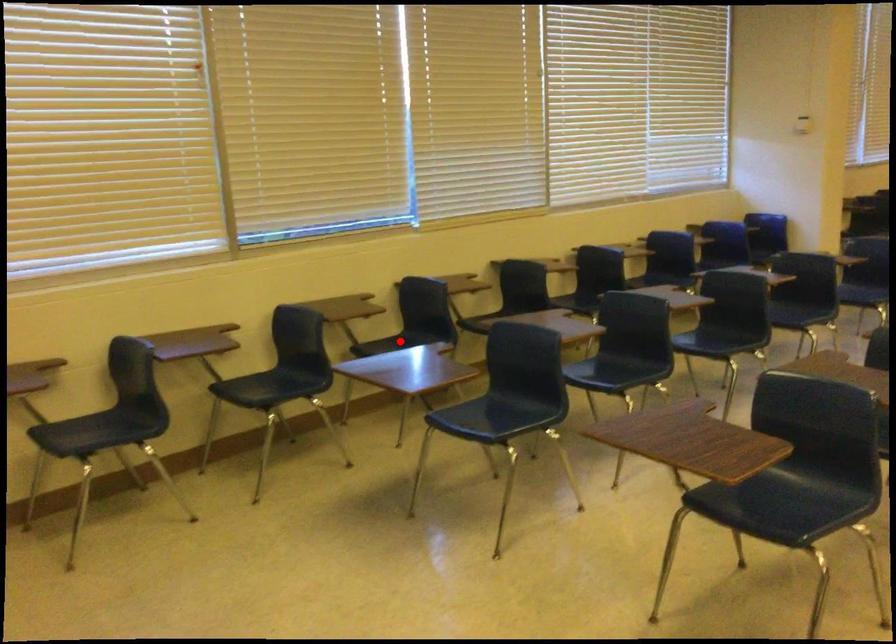
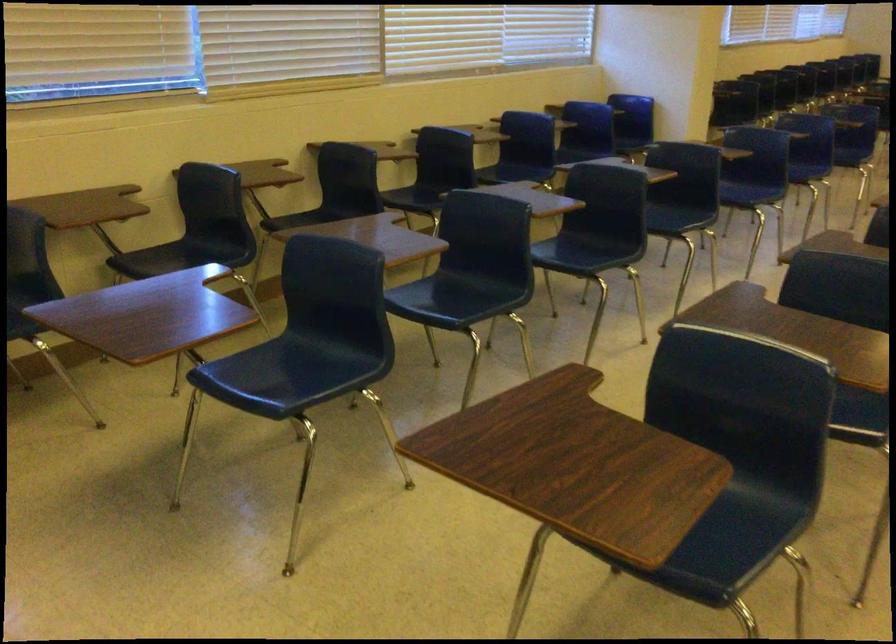
Where in the second image is the point corresponding to the highlighted location from the first image?

(181, 257)